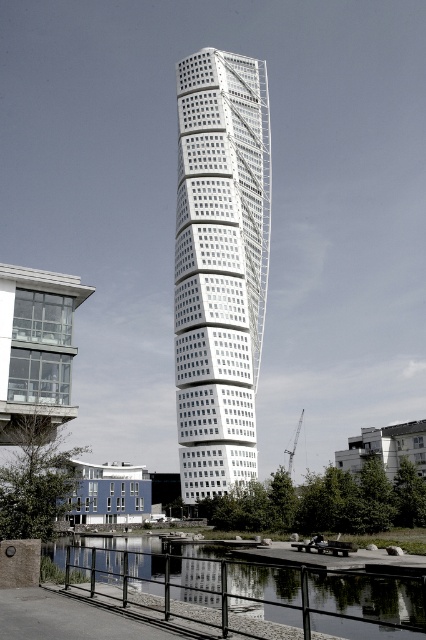
Question: Is blue painted concrete building at lower left behind metallic gray crane at lower center?

Choices:
 (A) yes
 (B) no

Answer: (B)

Question: Which of the following is the closest to the observer?

Choices:
 (A) blue painted concrete building at lower left
 (B) metallic gray crane at lower center
 (C) white glass building at center
 (D) white concrete building at lower right

Answer: (A)

Question: Estimate the real-world distances between objects in this image. Which object is closer to the white glass building at center?

Choices:
 (A) white concrete building at lower right
 (B) clear glass building at left
 (C) metallic gray crane at lower center
 (D) blue painted concrete building at lower left

Answer: (D)

Question: Which object is farther from the camera taking this photo?

Choices:
 (A) white concrete building at lower right
 (B) clear glass building at left

Answer: (A)

Question: From the image, what is the correct spatial relationship of white glass building at center in relation to blue painted concrete building at lower left?

Choices:
 (A) left
 (B) right

Answer: (B)

Question: Considering the relative positions of white glass building at center and white concrete building at lower right in the image provided, where is white glass building at center located with respect to white concrete building at lower right?

Choices:
 (A) below
 (B) above

Answer: (B)